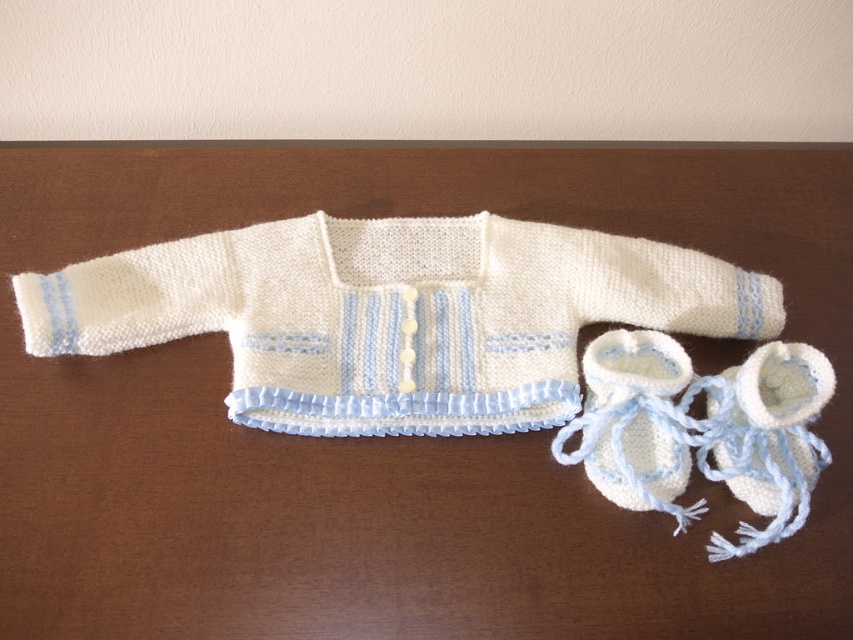
Is white knitted sweater at center positioned behind white knitted booties at lower right?

Yes, white knitted sweater at center is further from the viewer.

Who is more distant from viewer, (722, 284) or (635, 392)?

The point (722, 284) is behind.

Does point (614, 305) lie behind point (682, 435)?

Yes.

What are the coordinates of `white knitted sweater at center` in the screenshot? It's located at (393, 314).

Is point (740, 472) farther from viewer compared to point (595, 352)?

No, (740, 472) is closer to viewer.

Does point (714, 536) lie in front of point (641, 355)?

Yes, it is in front of point (641, 355).

Is point (706, 468) farther from viewer compared to point (560, 429)?

No, (706, 468) is in front of (560, 429).

Where is `white knitted bootie at lower right`? The image size is (853, 640). white knitted bootie at lower right is located at coordinates (764, 436).

Between white knitted sweater at center and white knitted bootie at lower right, which one has less height?

white knitted bootie at lower right

Does point (167, 317) come farther from viewer compared to point (717, 426)?

Yes, point (167, 317) is behind point (717, 426).

At what (x,y) coordinates should I click in order to perform the action: click on white knitted sweater at center. Please return your answer as a coordinate pair (x, y). Image resolution: width=853 pixels, height=640 pixels. Looking at the image, I should click on (393, 314).